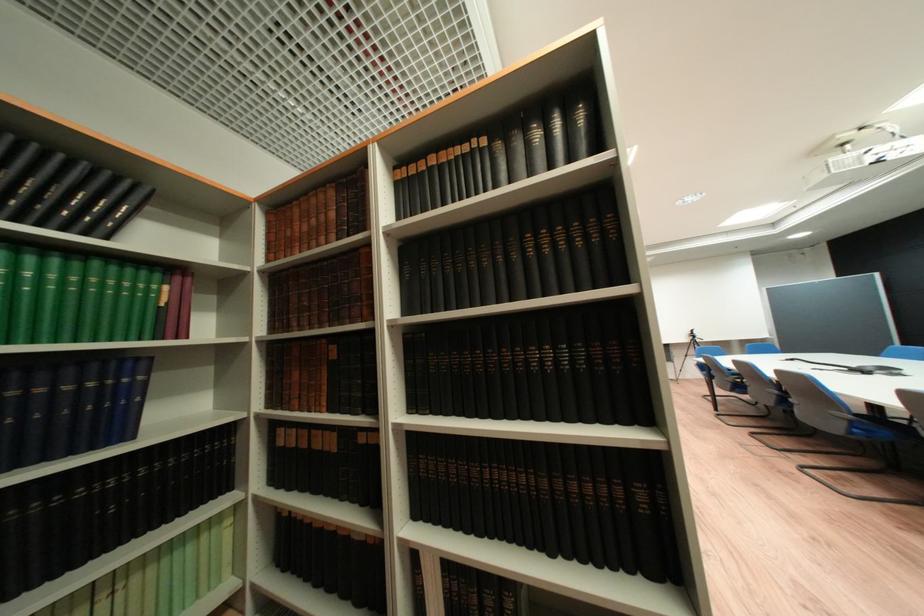
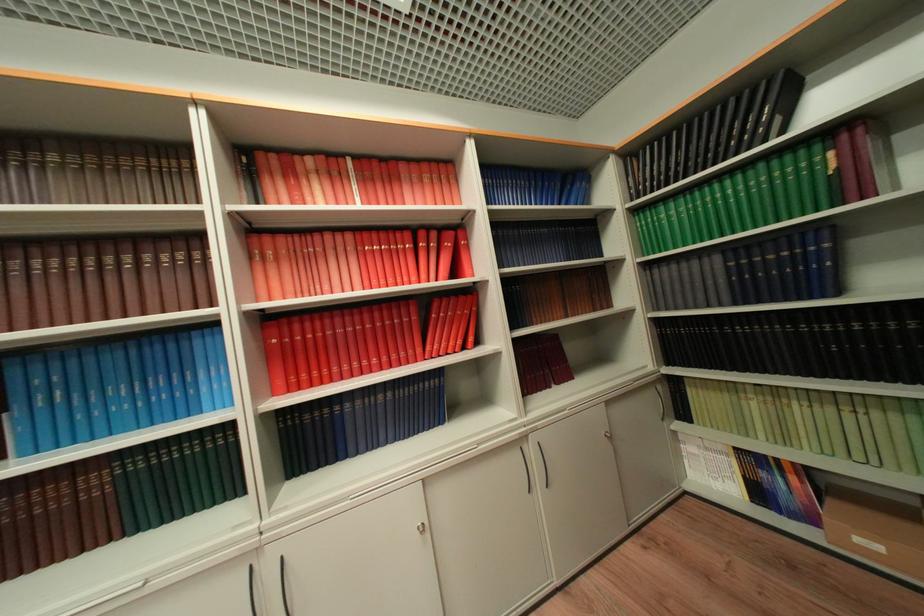
The point at (154, 274) is marked in the first image. Where is the corresponding point in the second image?

(813, 153)